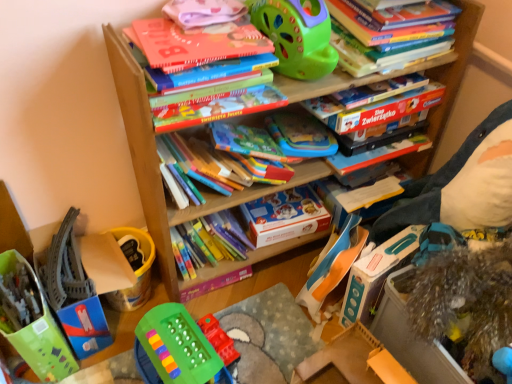
Identify the location of empty space that is ontop of green plastic toy at lower center, which is the second toy in left-to-right order (from a real-world perspective). (170, 343).